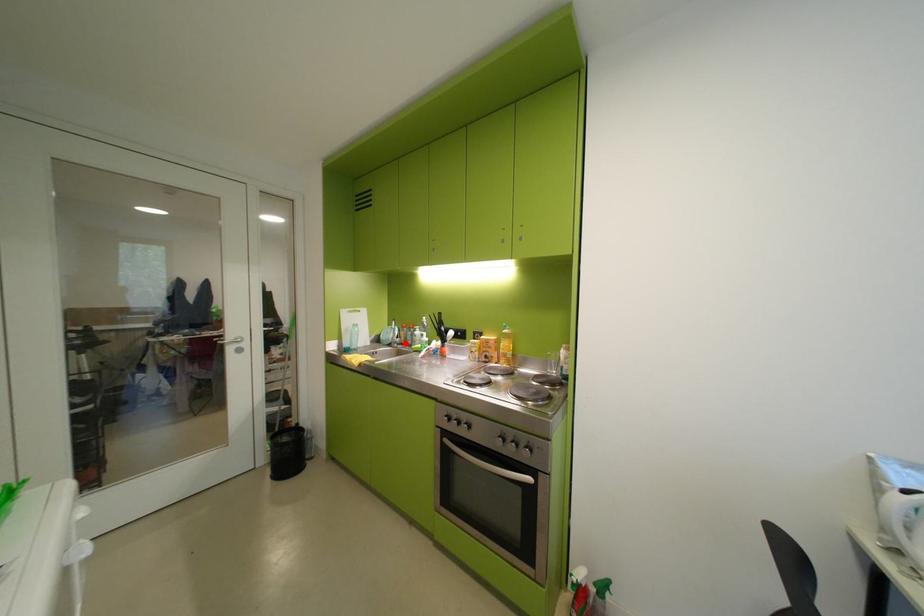
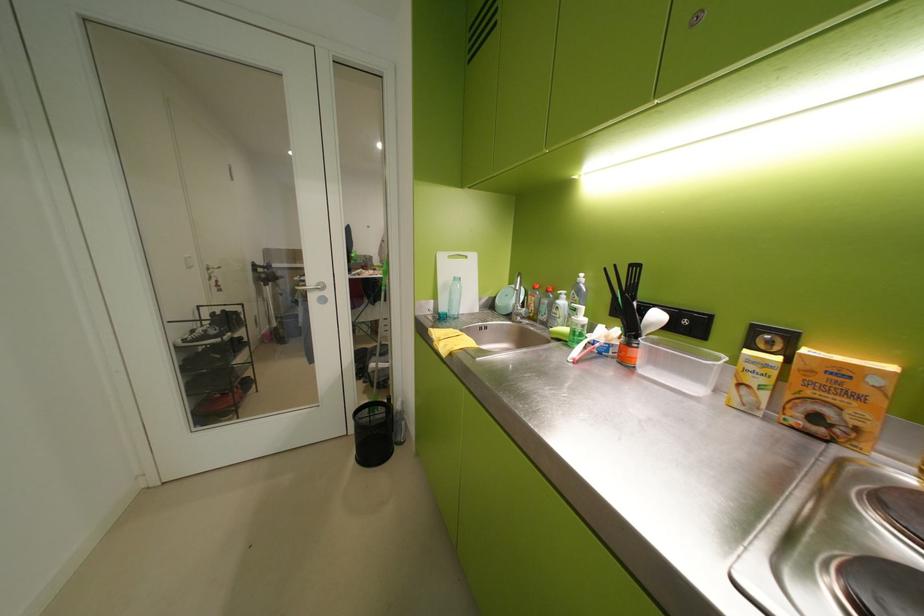
Where in the second image is the point corresponding to the highlighted location from the first image?

(529, 315)